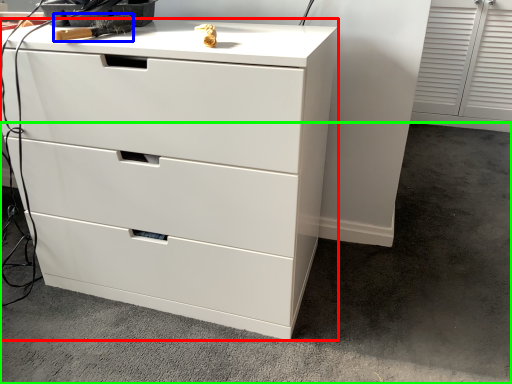
Question: Based on their relative distances, which object is farther from chest of drawers (highlighted by a red box)? Choose from tool (highlighted by a blue box) and concrete (highlighted by a green box).

Choices:
 (A) tool
 (B) concrete

Answer: (A)